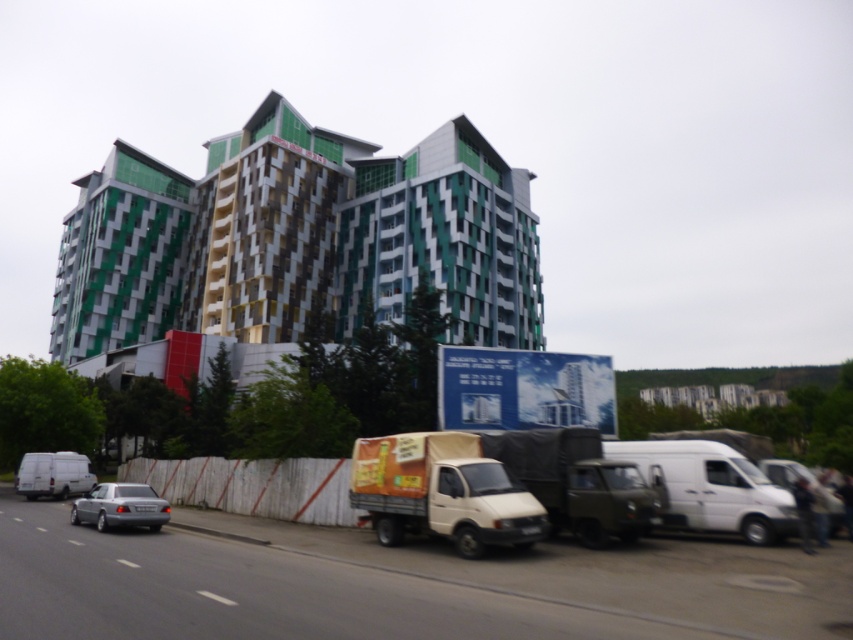
Question: Can you confirm if matte white truck at center is bigger than white matte van at lower left?

Choices:
 (A) yes
 (B) no

Answer: (A)

Question: Which point is farther to the camera?

Choices:
 (A) white matte van at lower left
 (B) silver metallic sedan at lower left
 (C) white matte truck at center

Answer: (A)

Question: Which point is farther from the camera taking this photo?

Choices:
 (A) (70, 483)
 (B) (543, 432)
 (C) (682, 476)
 (D) (390, 518)

Answer: (A)

Question: Which object appears closest to the camera in this image?

Choices:
 (A) white matte van at lower left
 (B) white matte van at lower right
 (C) matte white truck at center

Answer: (C)

Question: Where is white matte truck at center located in relation to white matte van at lower right in the image?

Choices:
 (A) below
 (B) above

Answer: (B)

Question: Is white matte truck at center above silver metallic sedan at lower left?

Choices:
 (A) no
 (B) yes

Answer: (B)